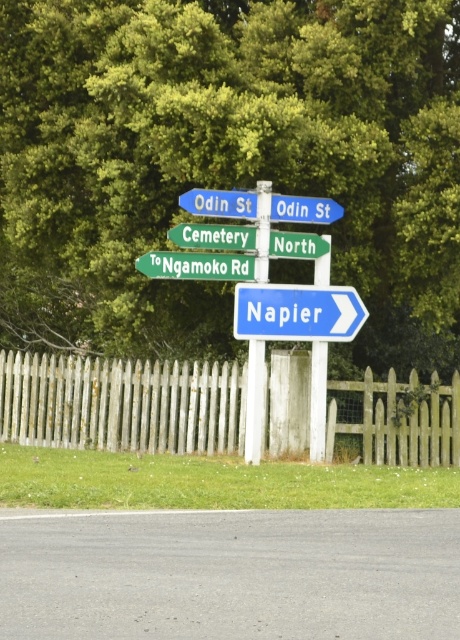
You are a delivery driver who needs to navigate through a narrow path between the white wooden fence at lower center and the blue plastic sign at center right. Based on the scene, can you safely pass through without hitting either object?

The white wooden fence at lower center is much taller than the blue plastic sign at center right. Since the fence is taller, you can safely pass through the narrow path without hitting either object as long as you stay between them.

Looking at this image, you are driving and need to turn left at the next intersection. You see a white wooden fence at lower center and a blue plastic street sign at upper center. Which object should you focus on to determine your direction?

You should focus on the blue plastic street sign at upper center because it provides directional information, while the white wooden fence at lower center is located to the left of it but does not indicate directions.

You are a delivery driver who needs to pass through the gap between the white wooden fence at lower center and the blue plastic sign at center right. Your delivery truck is 1.8 meters wide. Can you safely navigate through the gap without touching either the fence or the sign?

The gap between the white wooden fence at lower center and the blue plastic sign at center right is 1.87 meters. Since your truck is 1.8 meters wide, there is 0.07 meters of clearance on each side. While technically possible, this would require precise maneuvering to avoid contact with either the fence or the sign.